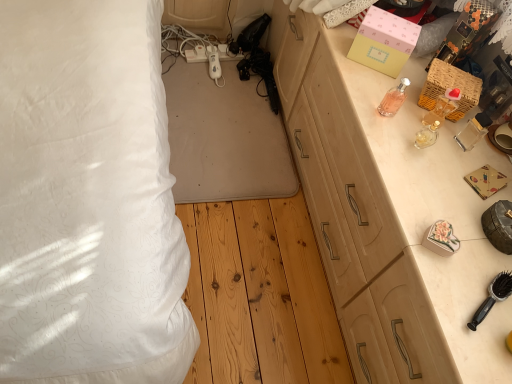
I want to click on free location above light wood cabinet at right (from a real-world perspective), so click(435, 158).